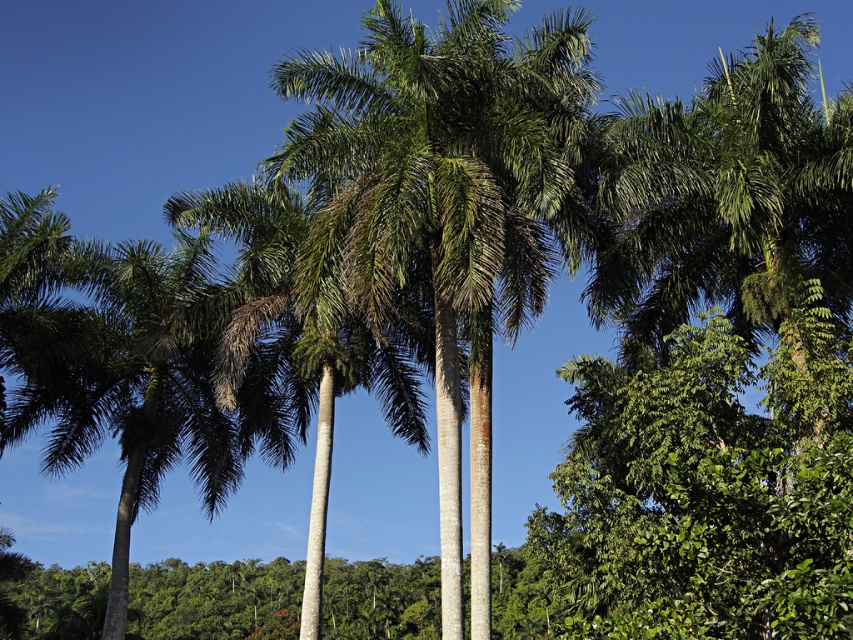
You are standing at the center of the tropical scene and see a point marked at coordinates (440, 184). Which object does this point correspond to?

The point at coordinates (440, 184) corresponds to the green leafy palm at center.

You are a bird flying over the tropical scene. You want to land on the green leafy palm at center and the green leafy palm tree at left. Which palm tree should you choose if you want to land on the one that is higher above the other?

The green leafy palm at center is positioned over the green leafy palm tree at left, so you should choose the green leafy palm at center to land on since it is higher.